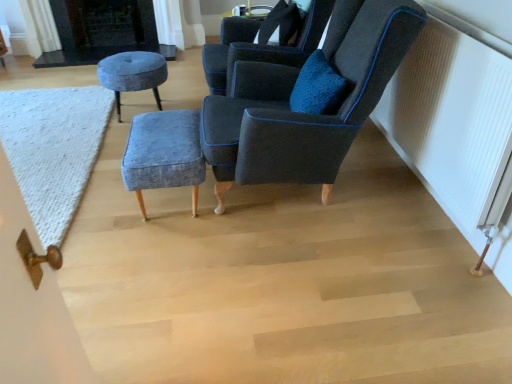
Question: Should I look upward or downward to see denim fabric stool at center, the 1th stool in the right-to-left sequence?

Choices:
 (A) down
 (B) up

Answer: (B)

Question: Could you tell me if denim fabric stool at center, arranged as the second stool when viewed from the top, is turned towards velvet blue stool at center, the 2th stool when ordered from bottom to top?

Choices:
 (A) no
 (B) yes

Answer: (A)

Question: Are denim fabric stool at center, positioned as the 2th stool in left-to-right order, and velvet blue stool at center, which is the first stool from top to bottom, beside each other?

Choices:
 (A) yes
 (B) no

Answer: (B)

Question: Can you confirm if denim fabric stool at center, the 1th stool in the right-to-left sequence, is taller than velvet blue stool at center, which is the first stool from top to bottom?

Choices:
 (A) yes
 (B) no

Answer: (B)

Question: From the image's perspective, does denim fabric stool at center, the 2th stool when ordered from back to front, appear lower than velvet blue stool at center, the 2th stool when ordered from bottom to top?

Choices:
 (A) no
 (B) yes

Answer: (B)

Question: Does denim fabric stool at center, which ranks as the 1th stool in front-to-back order, appear on the right side of velvet blue stool at center, which is the 2th stool in right-to-left order?

Choices:
 (A) no
 (B) yes

Answer: (B)

Question: Is velvet blue stool at center, the 1th stool when ordered from left to right, inside denim fabric stool at center, arranged as the second stool when viewed from the top?

Choices:
 (A) yes
 (B) no

Answer: (B)

Question: Are white textured radiator at right and dark gray stone fireplace at upper left making contact?

Choices:
 (A) yes
 (B) no

Answer: (B)

Question: Considering the relative sizes of white textured radiator at right and dark gray stone fireplace at upper left in the image provided, is white textured radiator at right taller than dark gray stone fireplace at upper left?

Choices:
 (A) yes
 (B) no

Answer: (A)

Question: From the image's perspective, is white textured radiator at right under dark gray stone fireplace at upper left?

Choices:
 (A) no
 (B) yes

Answer: (B)

Question: Is the depth of white textured radiator at right greater than that of dark gray stone fireplace at upper left?

Choices:
 (A) no
 (B) yes

Answer: (A)

Question: From a real-world perspective, is white textured radiator at right below dark gray stone fireplace at upper left?

Choices:
 (A) no
 (B) yes

Answer: (A)

Question: From the image's perspective, is white textured radiator at right on top of dark gray stone fireplace at upper left?

Choices:
 (A) yes
 (B) no

Answer: (B)

Question: Does white textured radiator at right have a lesser width compared to velvet dark blue chair at upper right, which is counted as the first chair, starting from the front?

Choices:
 (A) yes
 (B) no

Answer: (A)